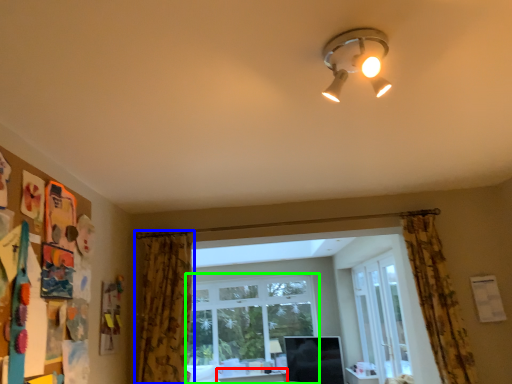
Question: Which is farther away from table (highlighted by a red box)? curtain (highlighted by a blue box) or window (highlighted by a green box)?

Choices:
 (A) curtain
 (B) window

Answer: (A)